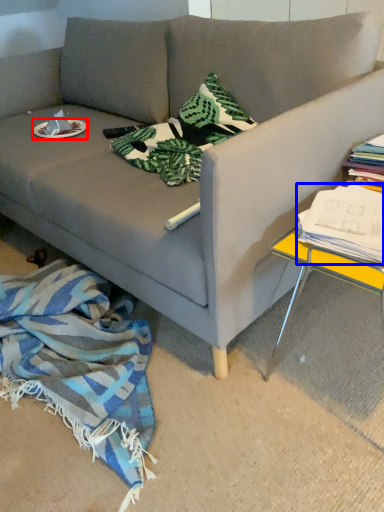
Question: Which point is closer to the camera, plate (highlighted by a red box) or magazine (highlighted by a blue box)?

Choices:
 (A) plate
 (B) magazine

Answer: (B)